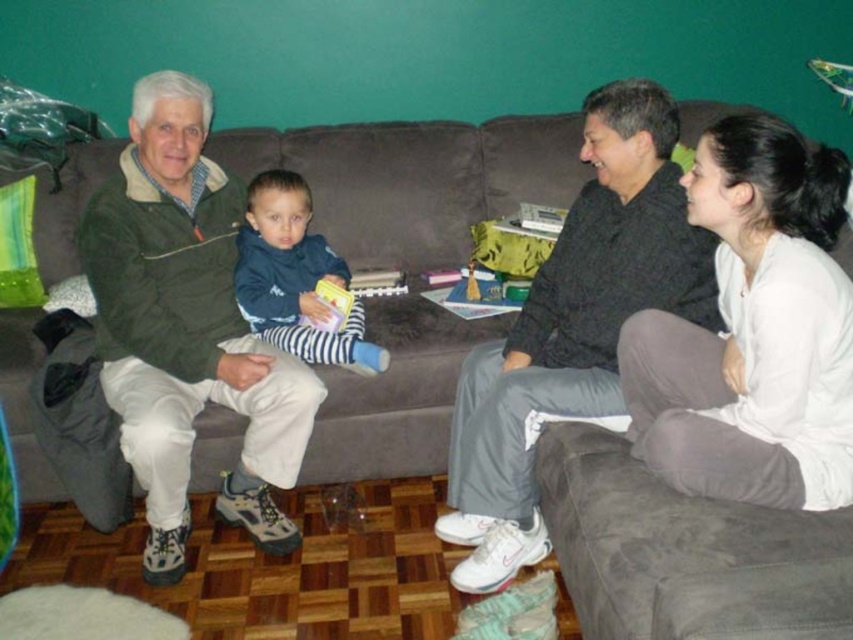
Question: Which of the following is the farthest from the observer?

Choices:
 (A) white soft sweater at lower right
 (B) dark gray pants at right

Answer: (B)

Question: Can you confirm if brown fabric couch at center is wider than green textured jacket at left?

Choices:
 (A) no
 (B) yes

Answer: (B)

Question: Can you confirm if green textured jacket at left is positioned above blue striped pants at center?

Choices:
 (A) yes
 (B) no

Answer: (B)

Question: In this image, where is white soft sweater at lower right located relative to blue striped pants at center?

Choices:
 (A) right
 (B) left

Answer: (A)

Question: Among these objects, which one is farthest from the camera?

Choices:
 (A) dark gray pants at right
 (B) white soft sweater at lower right
 (C) blue striped pants at center

Answer: (C)

Question: Which of the following is the farthest from the observer?

Choices:
 (A) (529, 544)
 (B) (756, 390)
 (C) (297, 252)
 (D) (432, 321)

Answer: (C)